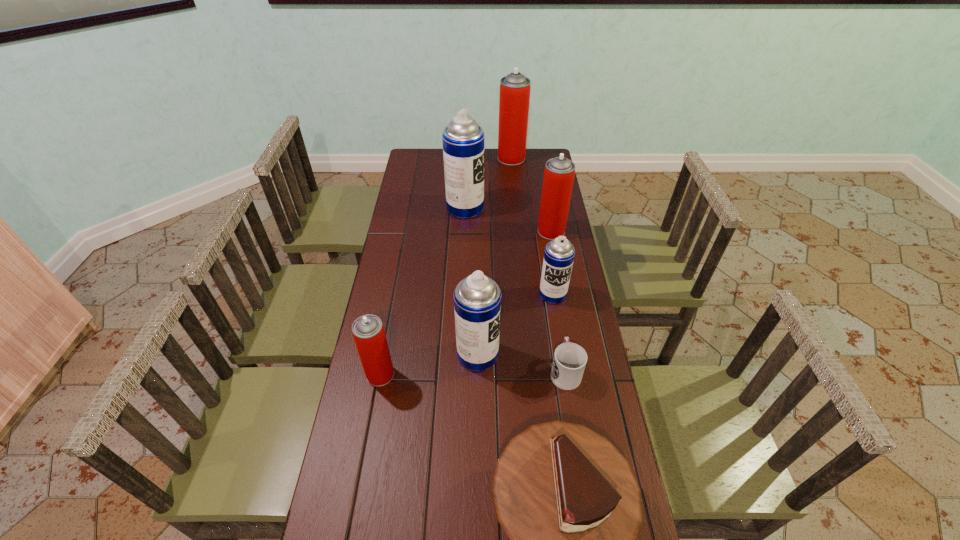
Identify the location of red aerosol can that is the closest to the second smallest blue aerosol can. (368, 332).

At what (x,y) coordinates should I click in order to perform the action: click on red aerosol can identified as the closest to the leftmost aerosol can. Please return your answer as a coordinate pair (x, y). The height and width of the screenshot is (540, 960). Looking at the image, I should click on (559, 172).

Identify the location of free space that satisfies the following two spatial constraints: 1. on the side of the fourth nearest aerosol can where the handle is located; 2. on the left side of the cup. (542, 231).

This screenshot has height=540, width=960. In order to click on free space that satisfies the following two spatial constraints: 1. on the side of the red cup where the handle is located; 2. on the label side of the second farthest object in this screenshot , I will do `click(540, 208)`.